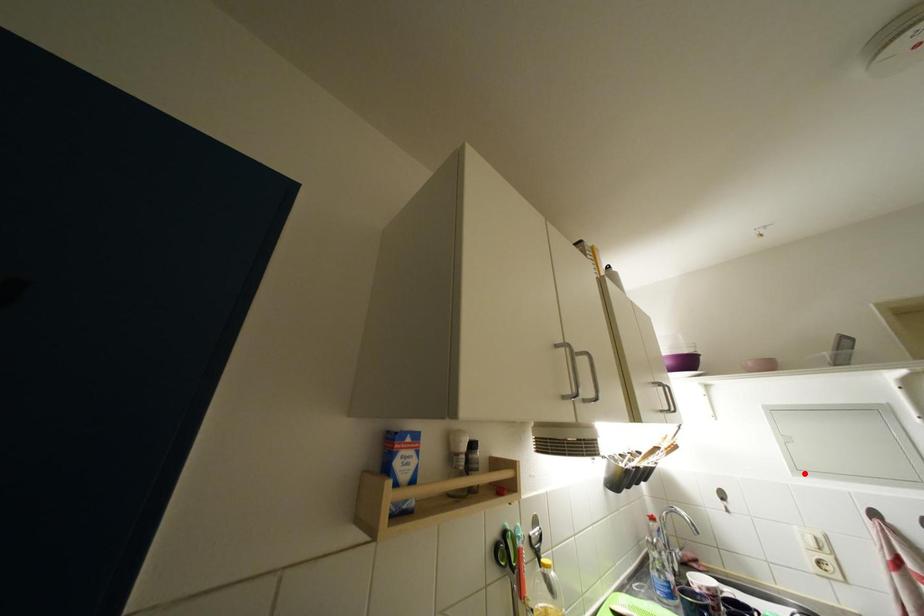
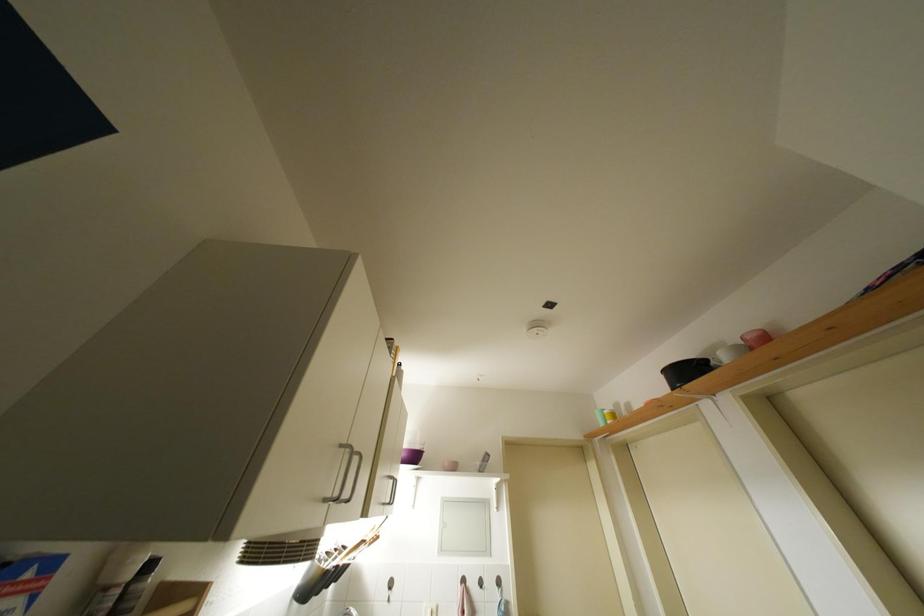
Question: I am providing you with two images of the same scene from different viewpoints. Given a red point in image1, look at the same physical point in image2. Is it:

Choices:
 (A) Closer to the viewpoint
 (B) Farther from the viewpoint

Answer: (B)